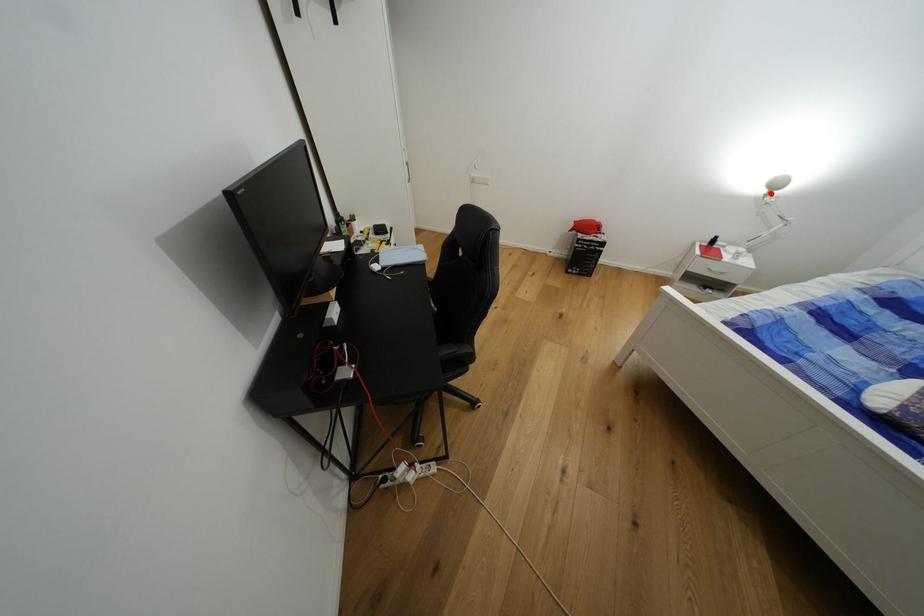
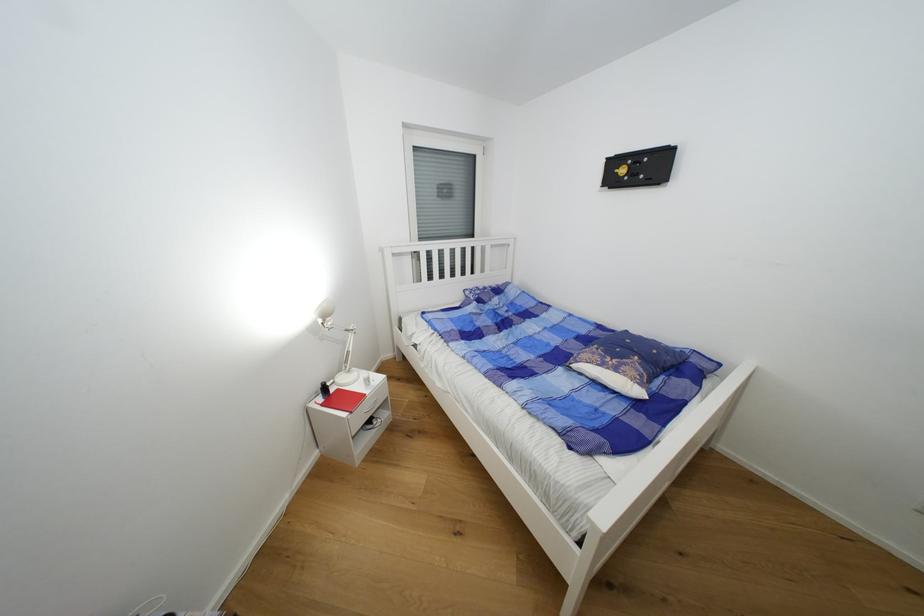
Locate, in the second image, the point that corresponds to the highlighted location in the first image.

(325, 323)